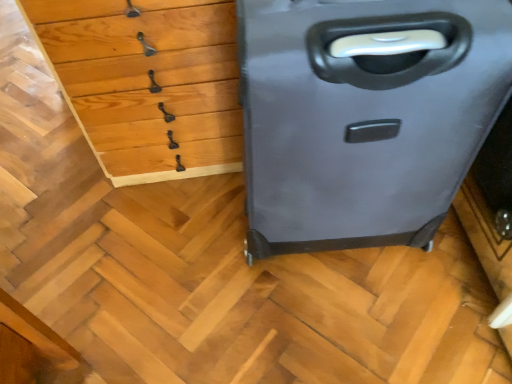
At what (x,y) coordinates should I click in order to perform the action: click on free space in front of matte gray suitcase at right. Please return your answer as a coordinate pair (x, y). The image size is (512, 384). Looking at the image, I should click on (348, 326).